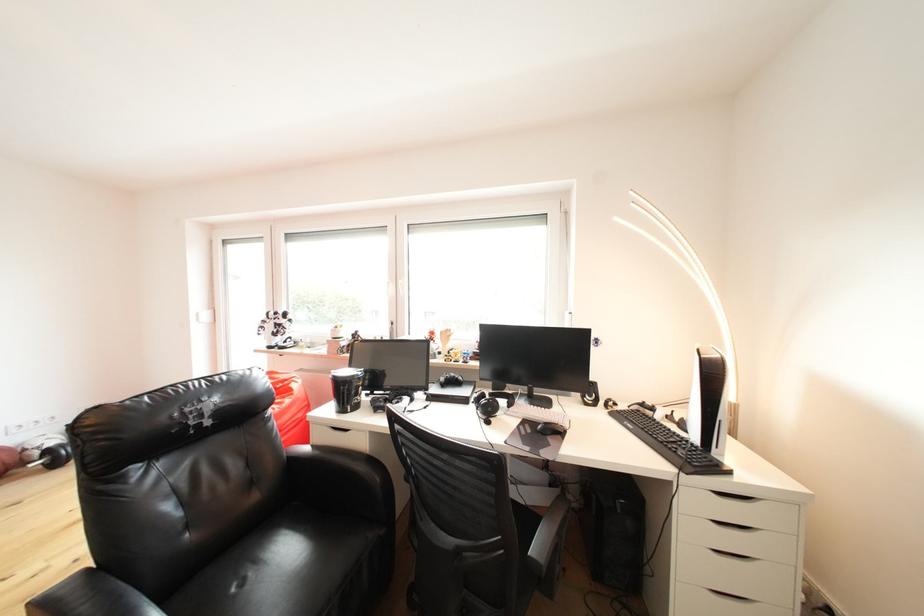
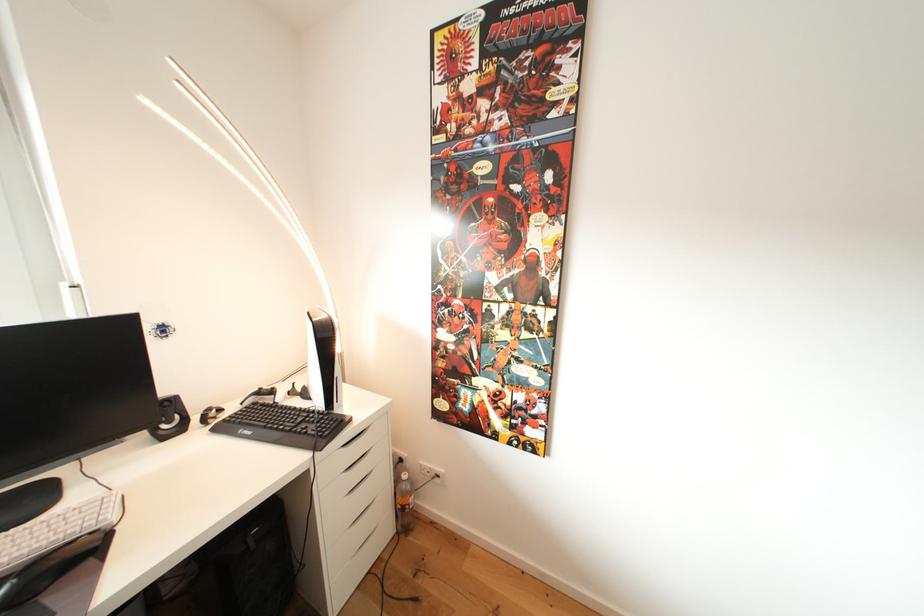
Where in the second image is the point corresponding to point (600, 402) from the first image?

(178, 427)